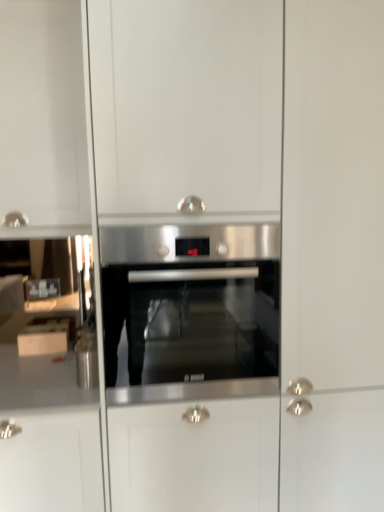
Question: Is stainless steel oven at center positioned with its back to white glossy cabinet at left?

Choices:
 (A) yes
 (B) no

Answer: (B)

Question: Is stainless steel oven at center thinner than white glossy cabinet at left?

Choices:
 (A) yes
 (B) no

Answer: (B)

Question: Is stainless steel oven at center shorter than white glossy cabinet at left?

Choices:
 (A) no
 (B) yes

Answer: (A)

Question: From a real-world perspective, is stainless steel oven at center physically above white glossy cabinet at left?

Choices:
 (A) no
 (B) yes

Answer: (B)

Question: Considering the relative sizes of stainless steel oven at center and white glossy cabinet at left in the image provided, is stainless steel oven at center wider than white glossy cabinet at left?

Choices:
 (A) yes
 (B) no

Answer: (A)

Question: Does stainless steel oven at center appear on the right side of white glossy cabinet at left?

Choices:
 (A) no
 (B) yes

Answer: (B)

Question: Does white glossy cabinet at left have a lesser width compared to stainless steel oven at center?

Choices:
 (A) yes
 (B) no

Answer: (A)

Question: Considering the relative sizes of white glossy cabinet at left and stainless steel oven at center in the image provided, is white glossy cabinet at left wider than stainless steel oven at center?

Choices:
 (A) no
 (B) yes

Answer: (A)

Question: Is white glossy cabinet at left touching stainless steel oven at center?

Choices:
 (A) no
 (B) yes

Answer: (A)

Question: Is stainless steel oven at center located within white glossy cabinet at left?

Choices:
 (A) no
 (B) yes

Answer: (A)

Question: From a real-world perspective, is white glossy cabinet at left on stainless steel oven at center?

Choices:
 (A) no
 (B) yes

Answer: (A)

Question: Is white glossy cabinet at left to the right of stainless steel oven at center from the viewer's perspective?

Choices:
 (A) yes
 (B) no

Answer: (B)

Question: From the image's perspective, relative to stainless steel oven at center, is white glossy cabinet at left above or below?

Choices:
 (A) above
 (B) below

Answer: (B)